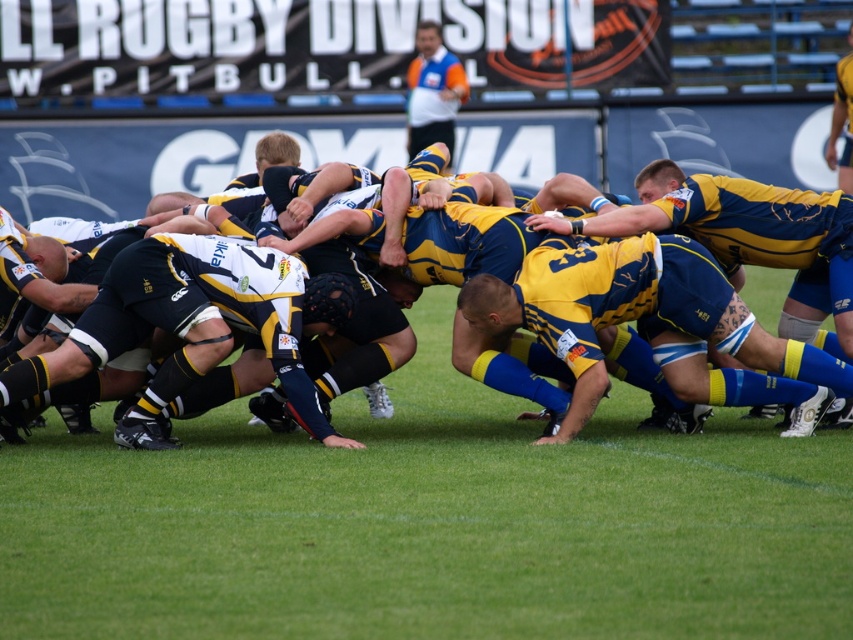
Does dark blue jersey at center appear on the left side of yellow and blue rugby jersey at center?

Correct, you'll find dark blue jersey at center to the left of yellow and blue rugby jersey at center.

Is dark blue jersey at center smaller than yellow and blue rugby jersey at center?

Yes, dark blue jersey at center is smaller than yellow and blue rugby jersey at center.

Find the location of a particular element. dark blue jersey at center is located at coordinates (184, 326).

Can you confirm if dark blue jersey at center is positioned below blue jersey at center?

Correct, dark blue jersey at center is located below blue jersey at center.

Locate an element on the screen. The image size is (853, 640). dark blue jersey at center is located at coordinates click(184, 326).

The height and width of the screenshot is (640, 853). I want to click on dark blue jersey at center, so click(x=184, y=326).

Which of these two, yellow and blue rugby jersey at center or orange shirt at upper center, stands shorter?

Standing shorter between the two is yellow and blue rugby jersey at center.

Between yellow and blue rugby jersey at center and orange shirt at upper center, which one is positioned lower?

yellow and blue rugby jersey at center is lower down.

Is point (544, 228) closer to camera compared to point (445, 129)?

Yes, it is in front of point (445, 129).

Identify the location of yellow and blue rugby jersey at center. The height and width of the screenshot is (640, 853). (749, 237).